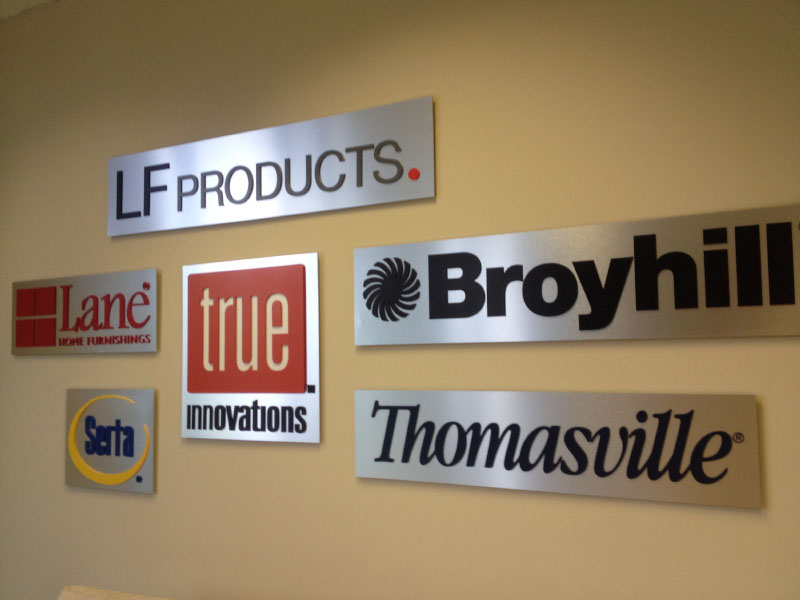
This screenshot has width=800, height=600. I want to click on wall, so click(318, 523).